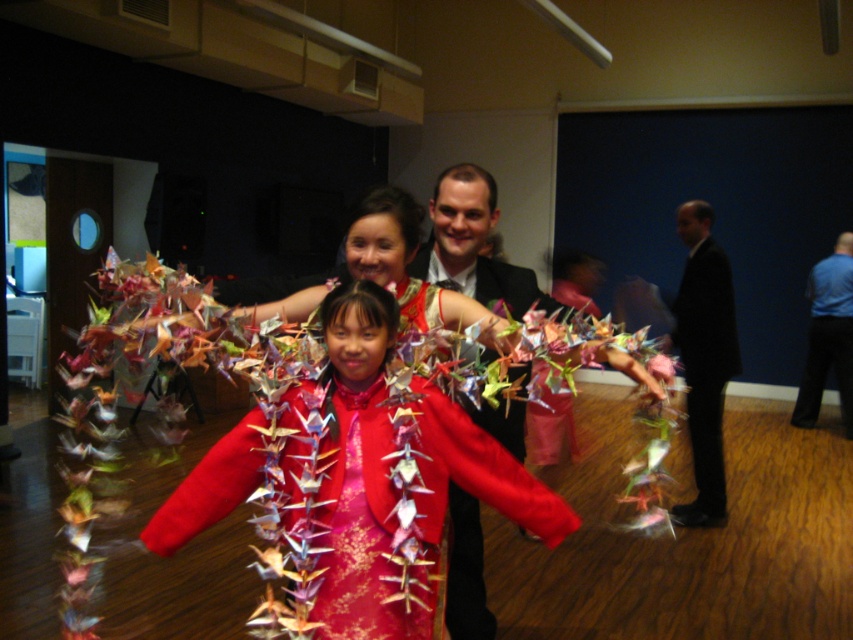
Who is more forward, (456,509) or (698,508)?

Point (456,509)

The width and height of the screenshot is (853, 640). What do you see at coordinates (471, 243) in the screenshot? I see `matte black suit at center` at bounding box center [471, 243].

Locate an element on the screen. matte black suit at center is located at coordinates (471, 243).

Based on the photo, is silky red dress at center shorter than blue smooth shirt at right?

Yes.

Who is taller, silky red dress at center or blue smooth shirt at right?

blue smooth shirt at right is taller.

Is point (351, 214) closer to viewer compared to point (846, 326)?

Yes, it is in front of point (846, 326).

This screenshot has width=853, height=640. Find the location of `silky red dress at center`. silky red dress at center is located at coordinates (398, 257).

Who is positioned more to the right, silky red dress at center or matte black suit at center?

From the viewer's perspective, matte black suit at center appears more on the right side.

Based on the photo, who is more distant from viewer, [379,228] or [454,218]?

Positioned behind is point [454,218].

Who is more distant from viewer, (x=483, y=628) or (x=479, y=413)?

Positioned behind is point (x=483, y=628).

The image size is (853, 640). I want to click on silky red dress at center, so click(398, 257).